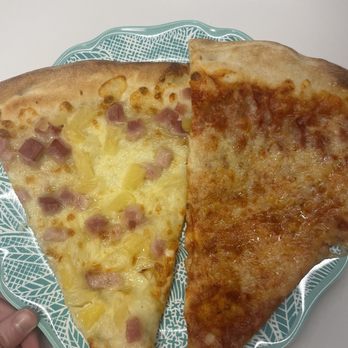
Locate an element on the screen. Image resolution: width=348 pixels, height=348 pixels. highlight on plastic plate is located at coordinates (302, 283), (321, 263), (303, 301), (260, 340), (177, 328), (35, 302), (49, 316), (7, 248), (172, 57).